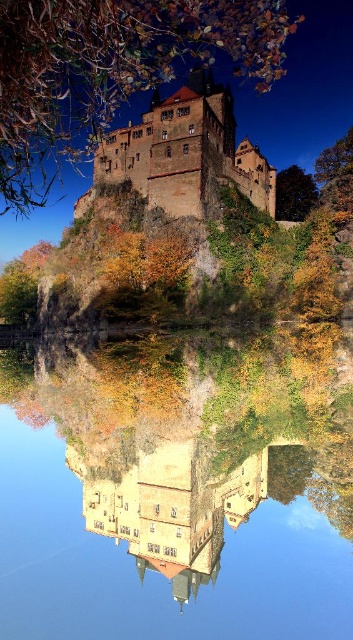
Is transparent glass water at center positioned in front of brown stone castle at upper center?

Yes, transparent glass water at center is closer to the viewer.

Can you confirm if transparent glass water at center is positioned below brown stone castle at upper center?

Indeed, transparent glass water at center is positioned under brown stone castle at upper center.

Is point (13, 451) closer to viewer compared to point (204, 125)?

Yes, point (13, 451) is closer to viewer.

The width and height of the screenshot is (353, 640). In order to click on transparent glass water at center in this screenshot , I will do `click(177, 484)`.